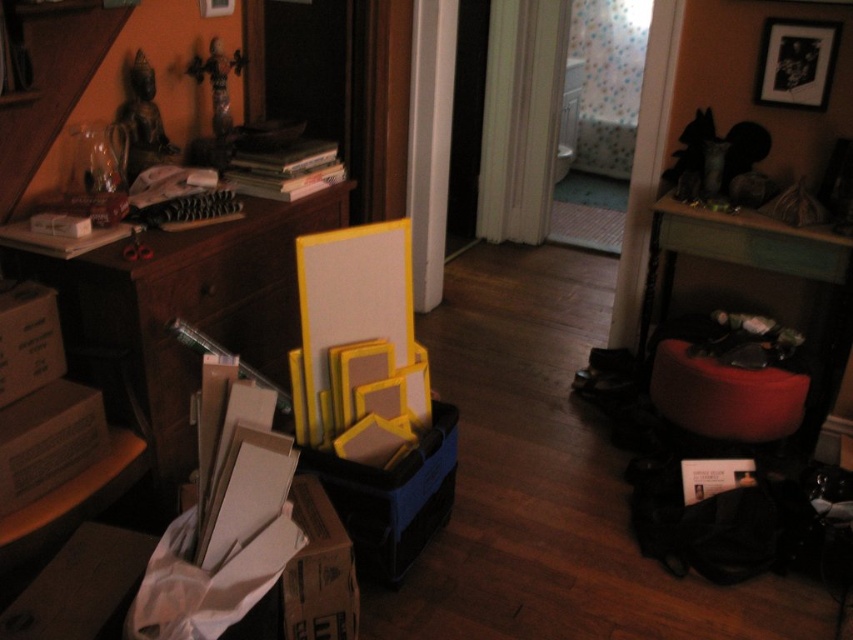
Question: Is wooden dresser at left below wooden drawer at center?

Choices:
 (A) yes
 (B) no

Answer: (B)

Question: Which point is farther from the camera taking this photo?

Choices:
 (A) (59, 3)
 (B) (55, 481)

Answer: (A)

Question: Considering the real-world distances, which object is closest to the cardboard box at lower center?

Choices:
 (A) cardboard box at left
 (B) matte glass vase at left
 (C) brown cardboard box at lower left
 (D) wooden drawer at center

Answer: (C)

Question: Can you confirm if matte glass vase at left is positioned above cardboard box at left?

Choices:
 (A) no
 (B) yes

Answer: (B)

Question: Which point is closer to the camera?

Choices:
 (A) cardboard box at lower center
 (B) matte glass vase at left
 (C) brown cardboard box at lower left
 (D) wooden drawer at center

Answer: (C)

Question: Can you confirm if matte glass vase at left is thinner than cardboard box at left?

Choices:
 (A) no
 (B) yes

Answer: (A)